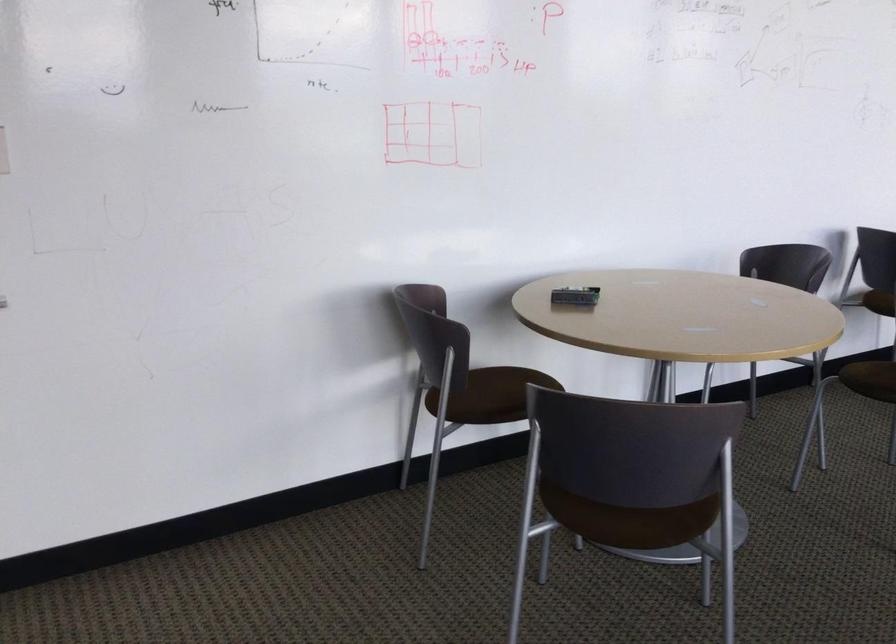
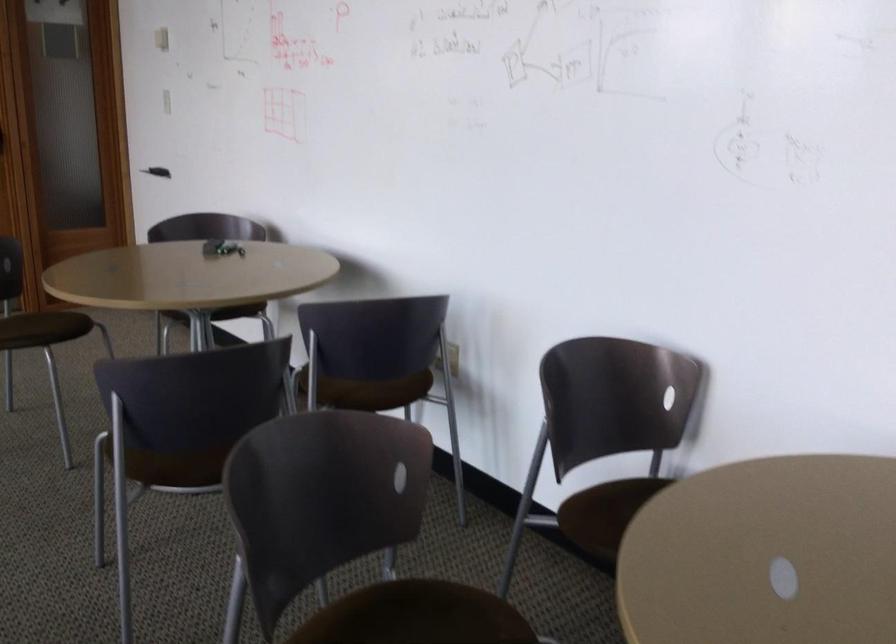
Question: I am providing you with two images of the same scene from different viewpoints. Please identify which objects are invisible in image2.

Choices:
 (A) red and white container
 (B) chair sitting surface
 (C) white light switch
 (D) brown chair sitting surface

Answer: (B)